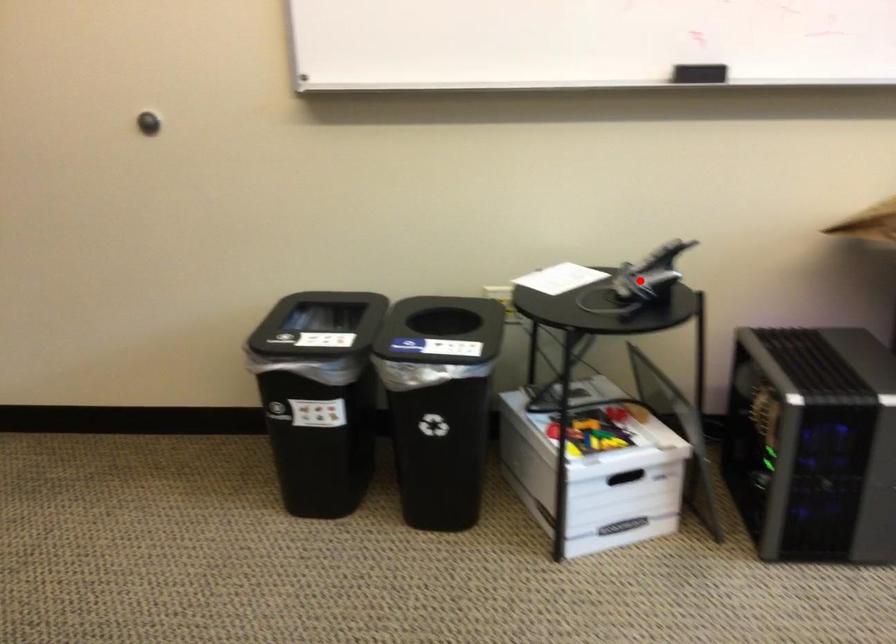
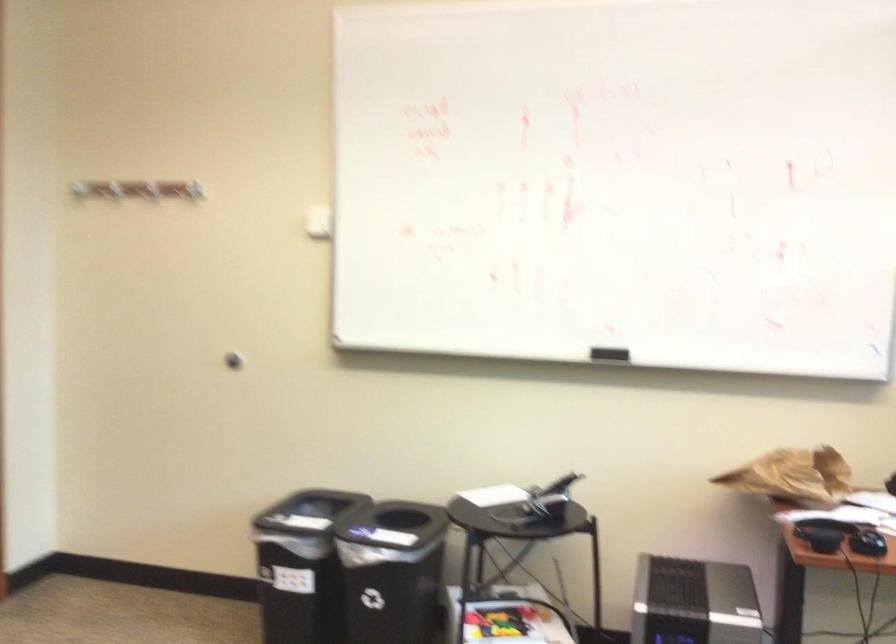
Locate, in the second image, the point that corresponds to the highlighted location in the first image.

(539, 503)